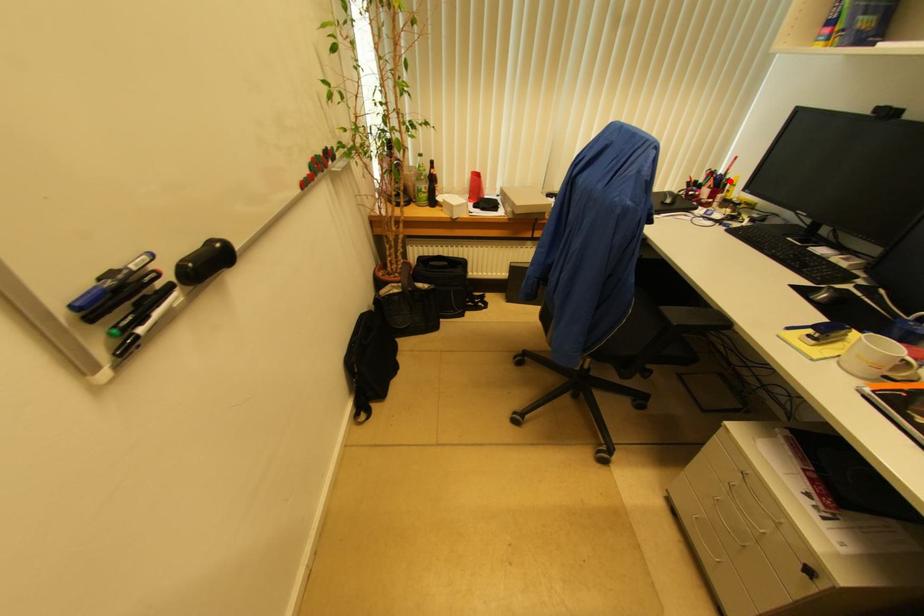
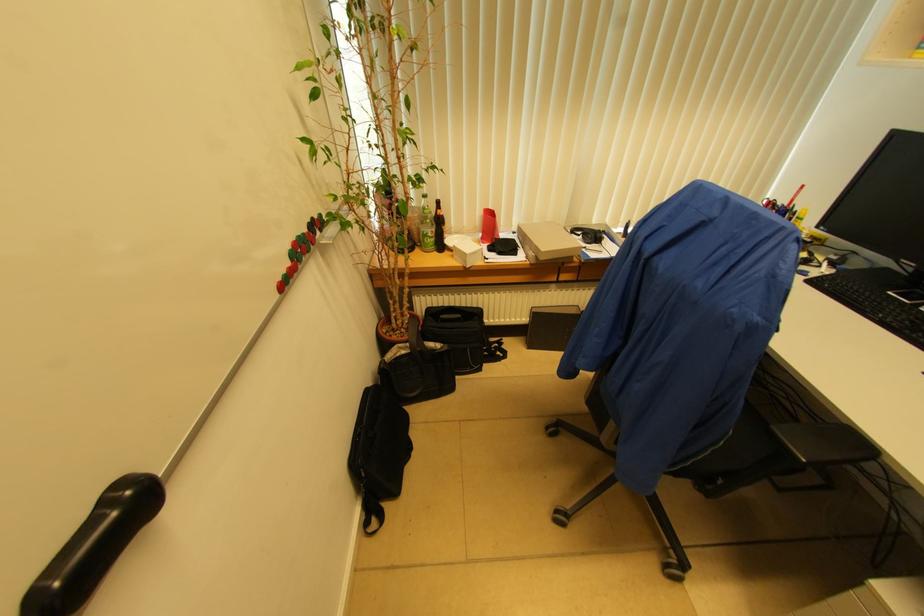
The point at the highlighted location is marked in the first image. Where is the corresponding point in the second image?

(796, 215)